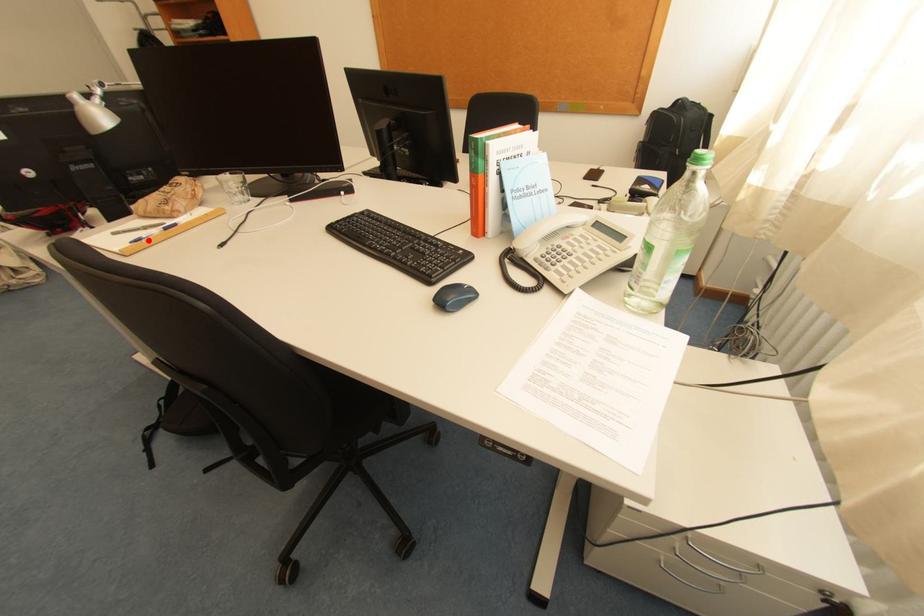
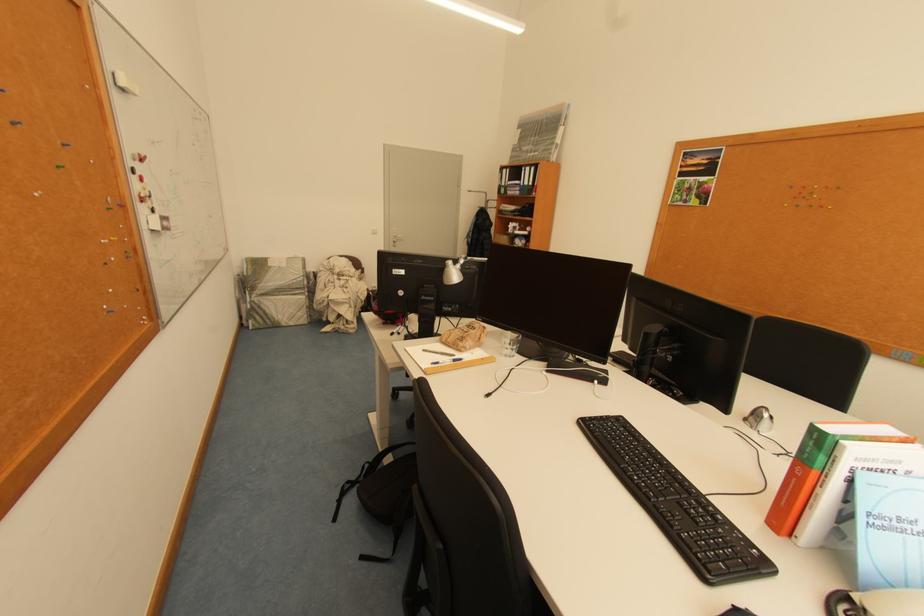
Question: I am providing you with two images of the same scene from different viewpoints. A red point is marked on the first image. Can you still see the location of the red point in image 2?

Choices:
 (A) Yes
 (B) No

Answer: (A)